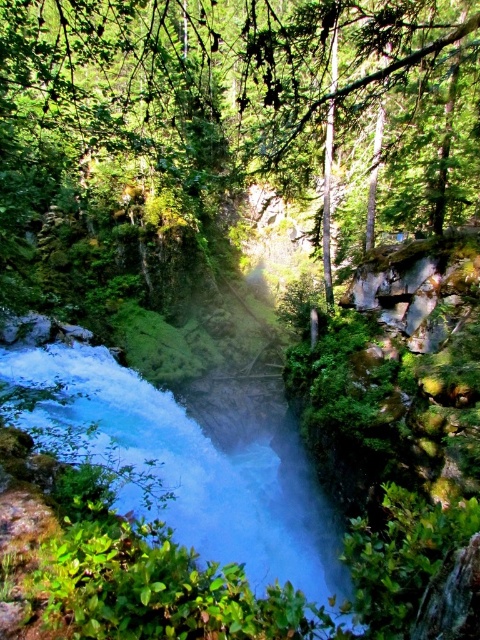
Between green leafy tree at center and white frothy water at center, which one is positioned lower?

Positioned lower is white frothy water at center.

Locate an element on the screen. This screenshot has height=640, width=480. green leafy tree at center is located at coordinates (179, 104).